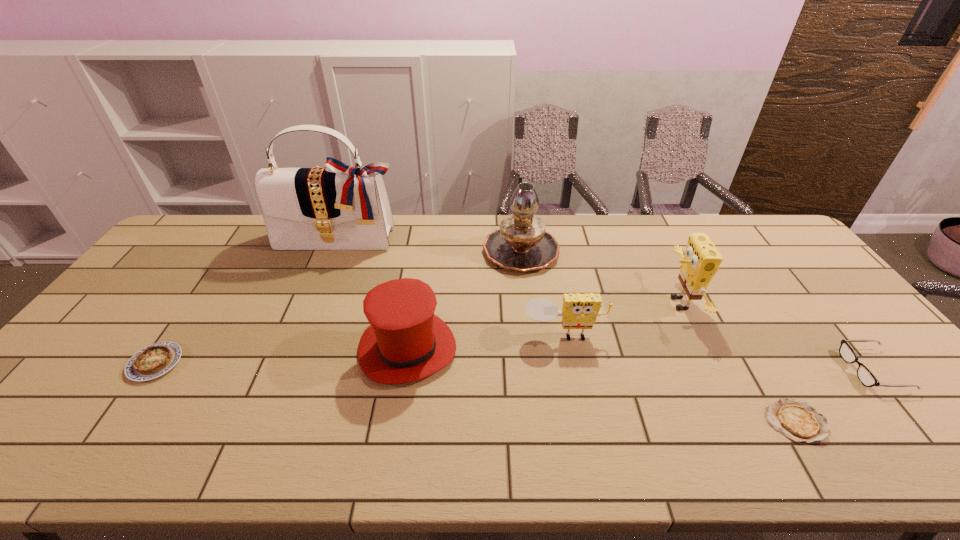
The width and height of the screenshot is (960, 540). Find the location of `free location at the far edge of the desktop`. free location at the far edge of the desktop is located at coordinates (309, 255).

Where is `free space at the near edge of the desktop`? The image size is (960, 540). free space at the near edge of the desktop is located at coordinates (852, 467).

This screenshot has width=960, height=540. In order to click on vacant region at the far left corner in this screenshot , I will do `click(202, 248)`.

The image size is (960, 540). I want to click on vacant space at the far right corner, so point(760,241).

Where is `blank region between the tallest object and the right sponge`? The height and width of the screenshot is (540, 960). blank region between the tallest object and the right sponge is located at coordinates (509, 272).

Where is `vacant space in between the oil lamp and the satchel`? The height and width of the screenshot is (540, 960). vacant space in between the oil lamp and the satchel is located at coordinates (430, 245).

Locate an element on the screen. The width and height of the screenshot is (960, 540). free point between the nearest object and the taller sponge is located at coordinates (736, 362).

Find the location of a particular element. The width and height of the screenshot is (960, 540). vacant space that is in between the hat and the taller sponge is located at coordinates (542, 326).

Locate an element on the screen. Image resolution: width=960 pixels, height=540 pixels. free point between the left quiche and the oil lamp is located at coordinates (338, 306).

You are a GUI agent. You are given a task and a screenshot of the screen. Output one action in this format:
    pyautogui.click(x=<x>, y=<y>)
    Task: Click on the free space between the hat and the second shortest object
    The width and height of the screenshot is (960, 540).
    Given the screenshot: What is the action you would take?
    pyautogui.click(x=281, y=356)